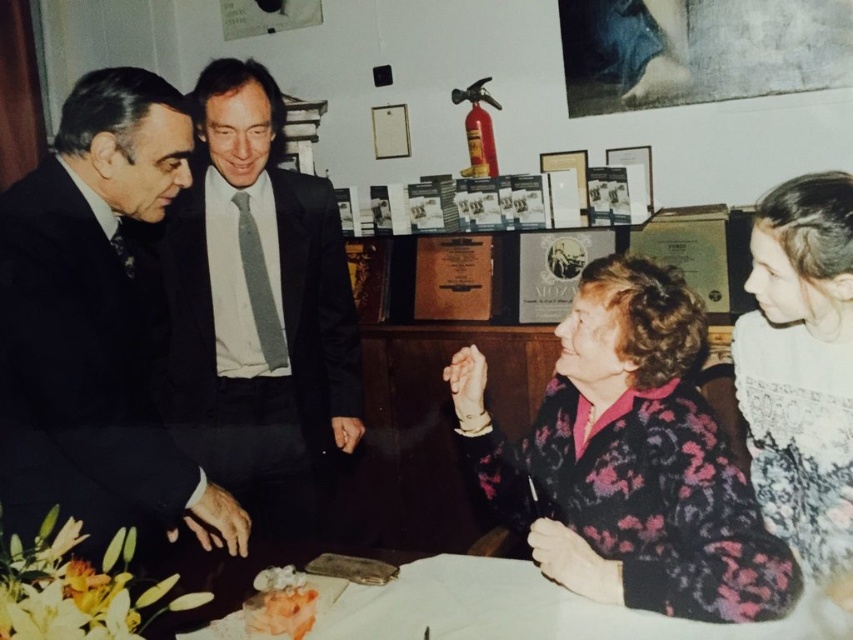
Does floral-patterned sweater at lower right have a lesser height compared to white lace dress at right?

Yes, floral-patterned sweater at lower right is shorter than white lace dress at right.

Does floral-patterned sweater at lower right appear on the right side of white lace dress at right?

No, floral-patterned sweater at lower right is not to the right of white lace dress at right.

At what (x,y) coordinates should I click in order to perform the action: click on floral-patterned sweater at lower right. Please return your answer as a coordinate pair (x, y). The height and width of the screenshot is (640, 853). Looking at the image, I should click on (630, 460).

Is dark gray suit at center in front of white lace dress at right?

→ No, it is not.

Can you confirm if dark gray suit at center is positioned to the right of white lace dress at right?

In fact, dark gray suit at center is to the left of white lace dress at right.

Is point (192, 225) closer to camera compared to point (833, 566)?

No, it is not.

Find the location of a particular element. Image resolution: width=853 pixels, height=640 pixels. dark gray suit at center is located at coordinates (257, 307).

Does dark suit at left have a lesser height compared to orange frosted cake at lower center?

No, dark suit at left is not shorter than orange frosted cake at lower center.

Between dark suit at left and orange frosted cake at lower center, which one is positioned higher?

→ dark suit at left is above.

At what (x,y) coordinates should I click in order to perform the action: click on dark suit at left. Please return your answer as a coordinate pair (x, y). Image resolution: width=853 pixels, height=640 pixels. Looking at the image, I should click on (94, 323).